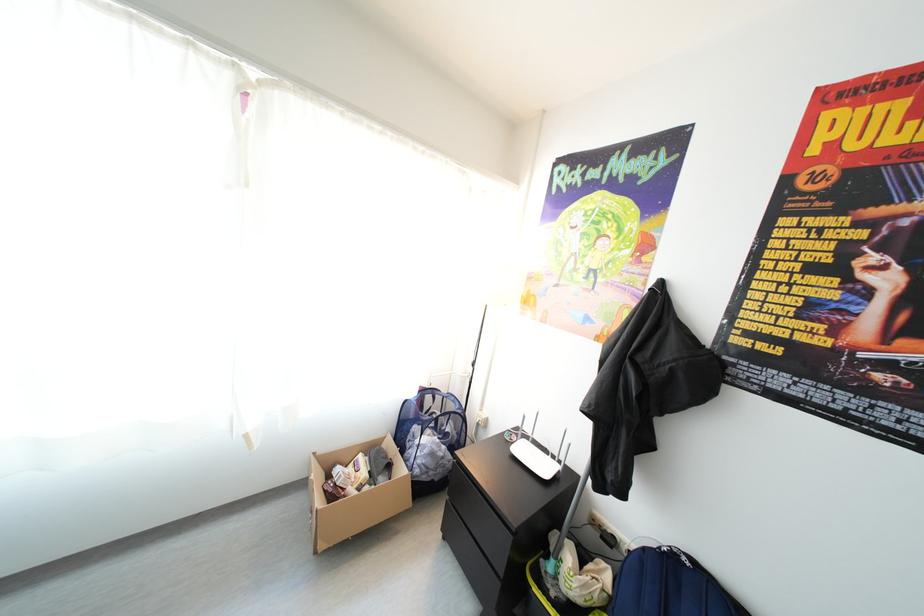
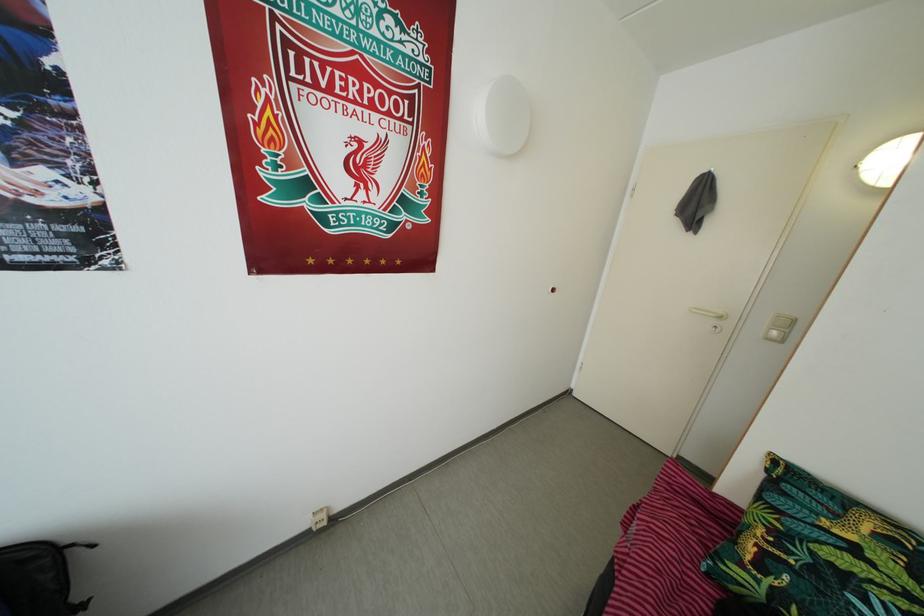
The images are taken continuously from a first-person perspective. In which direction is your viewpoint rotating?

The camera rotated toward right-down.